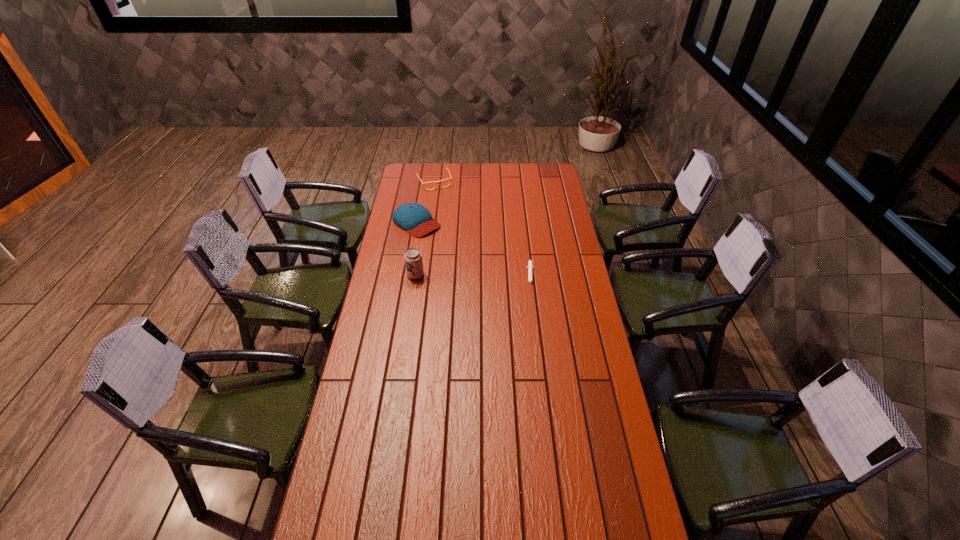
The height and width of the screenshot is (540, 960). In order to click on vacant space at the far edge in this screenshot , I will do `click(513, 168)`.

In the image, there is a desktop. What are the coordinates of `blank space at the near edge` in the screenshot? It's located at (492, 509).

What are the coordinates of `vacant area at the left edge of the desktop` in the screenshot? It's located at (365, 430).

Where is `vacant space at the right edge of the desktop`? vacant space at the right edge of the desktop is located at coordinates (540, 204).

Where is `free space at the near left corner of the desktop`? This screenshot has width=960, height=540. free space at the near left corner of the desktop is located at coordinates (355, 530).

The width and height of the screenshot is (960, 540). What are the coordinates of `free space between the syringe and the third nearest object` in the screenshot? It's located at (474, 249).

You are a GUI agent. You are given a task and a screenshot of the screen. Output one action in this format:
    pyautogui.click(x=<x>, y=<y>)
    Task: Click on the empty location between the syringe and the tallest object
    
    Given the screenshot: What is the action you would take?
    pyautogui.click(x=473, y=276)

Locate an element on the screen. Image resolution: width=960 pixels, height=540 pixels. free space between the shortest object and the baseball cap is located at coordinates (474, 249).

Identify the location of empty space between the spectacles and the syringe. The image size is (960, 540). (483, 230).

Identify which object is the second closest to the farthest object. Please provide its 2D coordinates. Your answer should be formatted as a tuple, i.e. [(x, y)], where the tuple contains the x and y coordinates of a point satisfying the conditions above.

[(413, 258)]